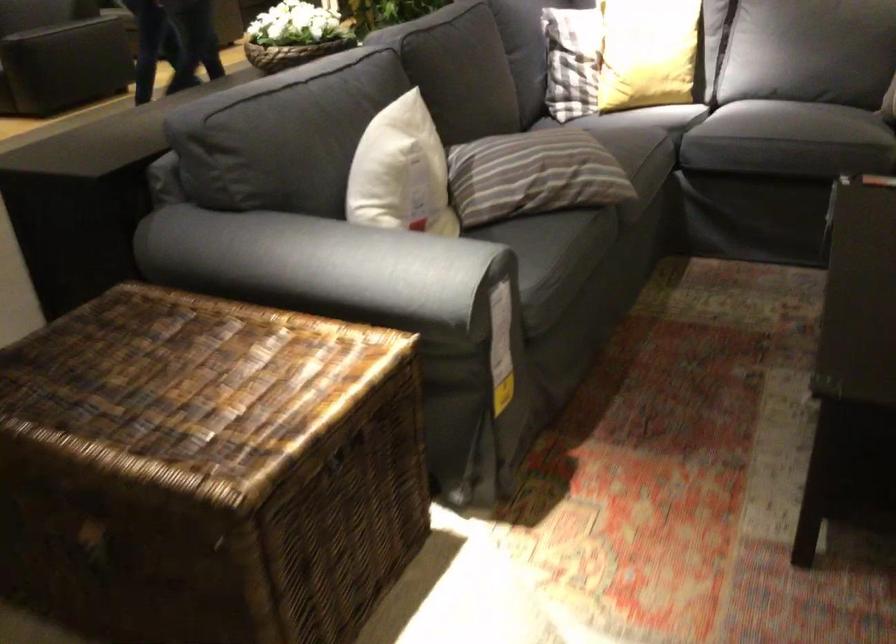
The height and width of the screenshot is (644, 896). Find the location of `wicker chest lid`. wicker chest lid is located at coordinates (195, 389).